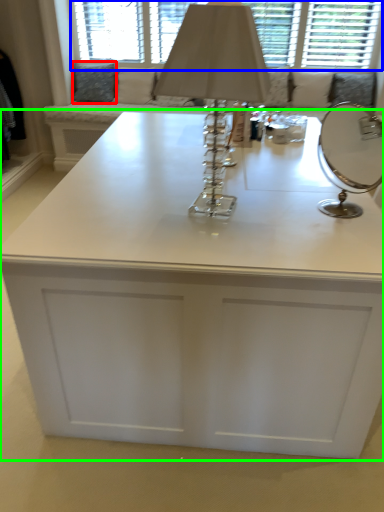
Question: Which object is the farthest from pillow (highlighted by a red box)? Choose among these: bay window (highlighted by a blue box) or table (highlighted by a green box).

Choices:
 (A) bay window
 (B) table

Answer: (B)